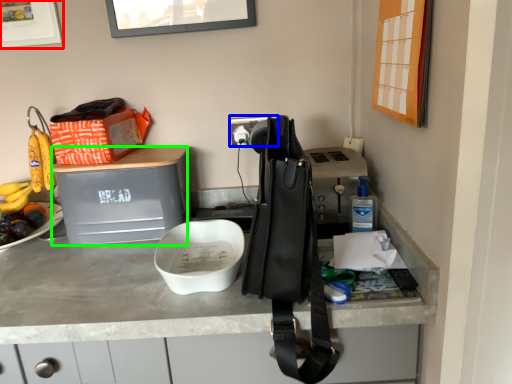
Question: Estimate the real-world distances between objects in this image. Which object is closer to picture frame (highlighted by a red box), power outlet (highlighted by a blue box) or wide (highlighted by a green box)?

Choices:
 (A) power outlet
 (B) wide

Answer: (B)